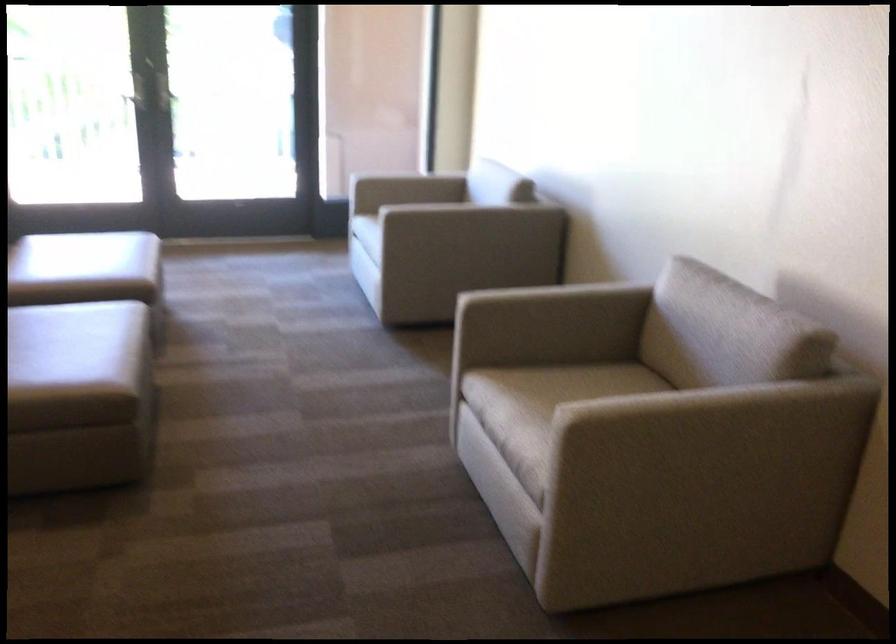
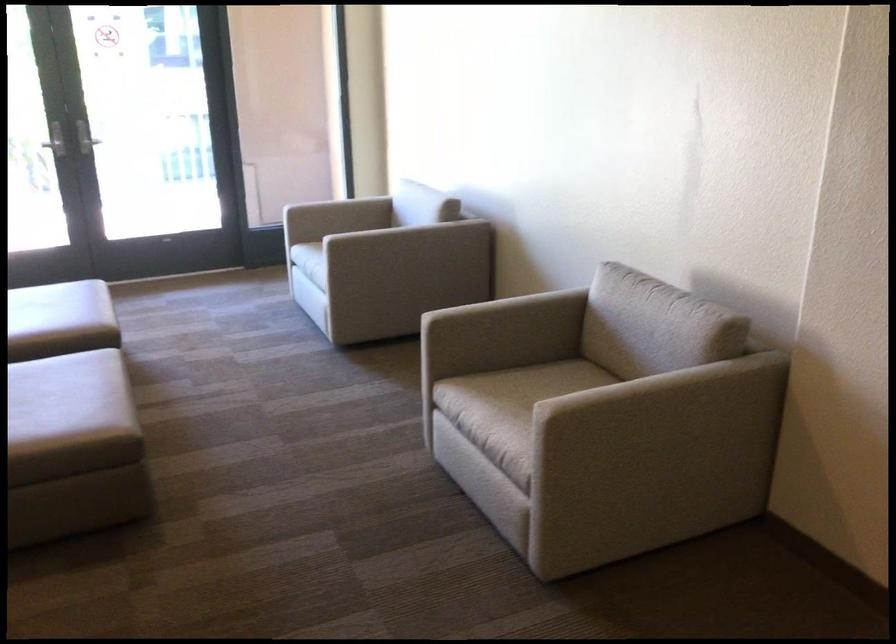
Where in the second image is the point corresponding to (x=565, y=295) from the first image?

(513, 304)